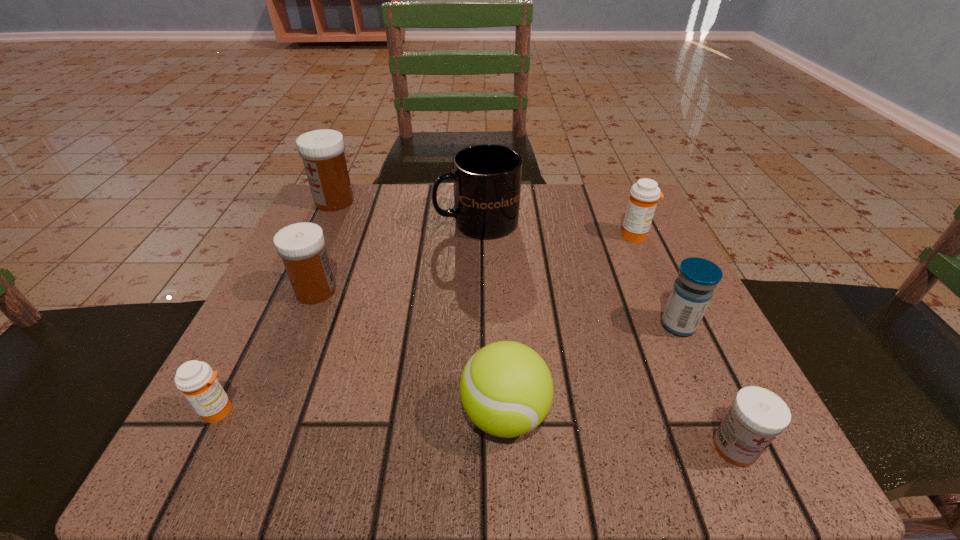
Point out which white medicine is positioned as the nearest to the tallest medicine. Please provide its 2D coordinates. Your answer should be formatted as a tuple, i.e. [(x, y)], where the tuple contains the x and y coordinates of a point satisfying the conditions above.

[(301, 246)]

Locate an element on the screen. The image size is (960, 540). vacant space that satisfies the following two spatial constraints: 1. with the handle on the side of the black mug; 2. on the back side of the fifth nearest medicine is located at coordinates (476, 235).

Identify the location of free space in the image that satisfies the following two spatial constraints: 1. on the back side of the nearer orange medicine; 2. on the left side of the bigger orange medicine. The image size is (960, 540). pos(307,235).

This screenshot has height=540, width=960. In order to click on free spot that satisfies the following two spatial constraints: 1. on the front side of the fourth farthest medicine; 2. on the right side of the nearest white medicine in this screenshot , I will do `click(734, 447)`.

The height and width of the screenshot is (540, 960). What are the coordinates of `free space that satisfies the following two spatial constraints: 1. on the back side of the fifth farthest object; 2. with the handle on the side of the mug` in the screenshot? It's located at (632, 222).

Find the location of a particular element. The image size is (960, 540). free location that satisfies the following two spatial constraints: 1. on the front side of the fifth nearest object; 2. on the right side of the blue medicine is located at coordinates (301, 325).

Where is `free space that satisfies the following two spatial constraints: 1. on the front side of the tennis ball; 2. on the left side of the biggest white medicine`? Image resolution: width=960 pixels, height=540 pixels. free space that satisfies the following two spatial constraints: 1. on the front side of the tennis ball; 2. on the left side of the biggest white medicine is located at coordinates (234, 414).

Where is `vacant space that satisfies the following two spatial constraints: 1. on the front side of the third nearest medicine; 2. on the left side of the nearest medicine`? This screenshot has width=960, height=540. vacant space that satisfies the following two spatial constraints: 1. on the front side of the third nearest medicine; 2. on the left side of the nearest medicine is located at coordinates (734, 447).